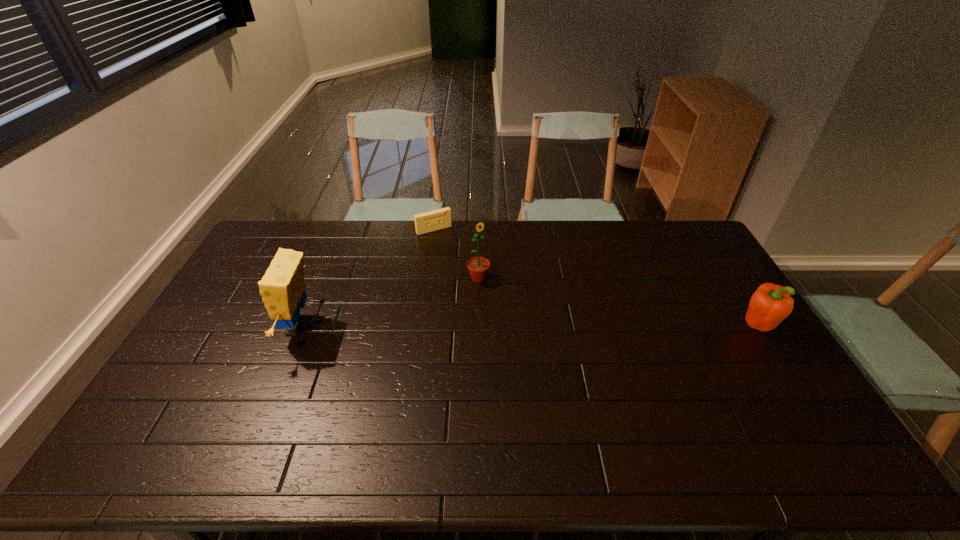
Identify the location of vacant region located on the left of the second shortest object. Image resolution: width=960 pixels, height=540 pixels. (641, 327).

Locate an element on the screen. The image size is (960, 540). vacant point located on the face of the sunflower is located at coordinates (548, 361).

You are a GUI agent. You are given a task and a screenshot of the screen. Output one action in this format:
    pyautogui.click(x=<x>, y=<y>)
    Task: Click on the free point located 0.380m on the face of the sunflower
    Image resolution: width=960 pixels, height=540 pixels.
    Given the screenshot: What is the action you would take?
    pyautogui.click(x=550, y=363)

Locate an element on the screen. The image size is (960, 540). vacant space located on the face of the sunflower is located at coordinates pyautogui.click(x=501, y=305).

At what (x,y) coordinates should I click in order to perform the action: click on vacant space located 0.310m at the front of the videotape with spools. Please return your answer as a coordinate pair (x, y). Looking at the image, I should click on (473, 282).

Where is `blank space located at the front of the videotape with spools`? Image resolution: width=960 pixels, height=540 pixels. blank space located at the front of the videotape with spools is located at coordinates (471, 281).

At what (x,y) coordinates should I click in order to perform the action: click on free region located 0.080m at the front of the videotape with spools. Please return your answer as a coordinate pair (x, y). The image size is (960, 540). Looking at the image, I should click on [448, 246].

Image resolution: width=960 pixels, height=540 pixels. I want to click on object that is positioned at the far edge, so click(434, 220).

Image resolution: width=960 pixels, height=540 pixels. I want to click on object positioned at the right edge, so click(770, 304).

Find the location of a particular element. The image size is (960, 540). free region at the far edge of the desktop is located at coordinates (557, 230).